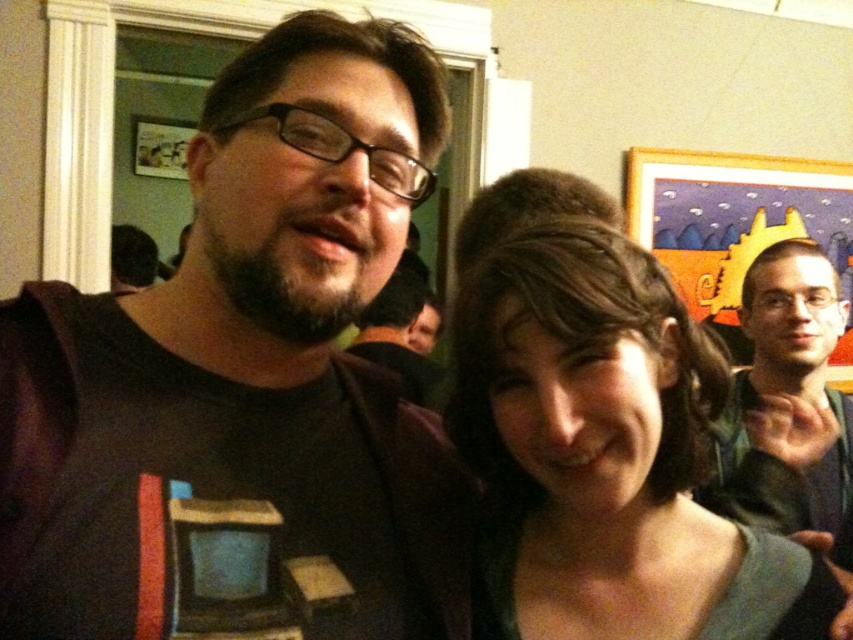
Question: Among these objects, which one is nearest to the camera?

Choices:
 (A) dark brown t-shirt at left
 (B) matte black shirt at center
 (C) smooth green dress at center
 (D) green fabric shirt at right

Answer: (A)

Question: Can you confirm if dark brown t-shirt at left is positioned to the right of matte black shirt at center?

Choices:
 (A) no
 (B) yes

Answer: (B)

Question: Which object is the farthest from the matte black shirt at center?

Choices:
 (A) dark brown t-shirt at left
 (B) green fabric shirt at right
 (C) smooth green dress at center

Answer: (A)

Question: Which point is closer to the camera?

Choices:
 (A) dark brown t-shirt at left
 (B) green fabric shirt at right
 (C) matte black shirt at center
 (D) smooth green dress at center

Answer: (A)

Question: Is green fabric shirt at right further to camera compared to matte black shirt at center?

Choices:
 (A) yes
 (B) no

Answer: (B)

Question: Observing the image, what is the correct spatial positioning of smooth green dress at center in reference to matte black shirt at center?

Choices:
 (A) above
 (B) below

Answer: (B)